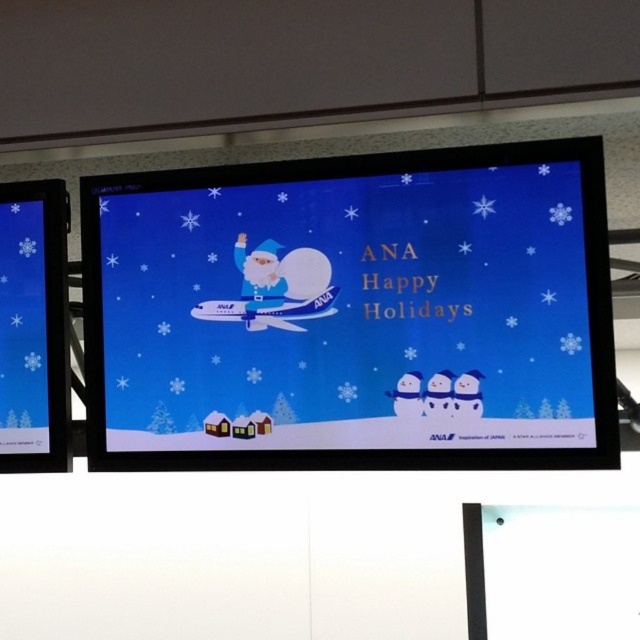
I want to click on blue glossy screen at left, so click(33, 326).

Does blue glossy screen at left have a larger size compared to matte blue santa at center?

Correct, blue glossy screen at left is larger in size than matte blue santa at center.

Image resolution: width=640 pixels, height=640 pixels. I want to click on blue glossy screen at left, so click(33, 326).

Consider the image. Does blue glossy screen at center come behind matte blue santa at center?

No, blue glossy screen at center is closer to the viewer.

Is blue glossy screen at center smaller than matte blue santa at center?

Incorrect, blue glossy screen at center is not smaller in size than matte blue santa at center.

Is point (467, 416) positioned in front of point (298, 250)?

Yes, it is in front of point (298, 250).

You are a GUI agent. You are given a task and a screenshot of the screen. Output one action in this format:
    pyautogui.click(x=<x>, y=<y>)
    Task: Click on the blue glossy screen at center
    Image resolution: width=640 pixels, height=640 pixels.
    Given the screenshot: What is the action you would take?
    pyautogui.click(x=353, y=312)

Does blue glossy screen at center have a greater width compared to blue glossy screen at left?

Yes, blue glossy screen at center is wider than blue glossy screen at left.

Between point (492, 172) and point (4, 230), which one is positioned behind?

Point (4, 230)

Where is `blue glossy screen at center`? blue glossy screen at center is located at coordinates (353, 312).